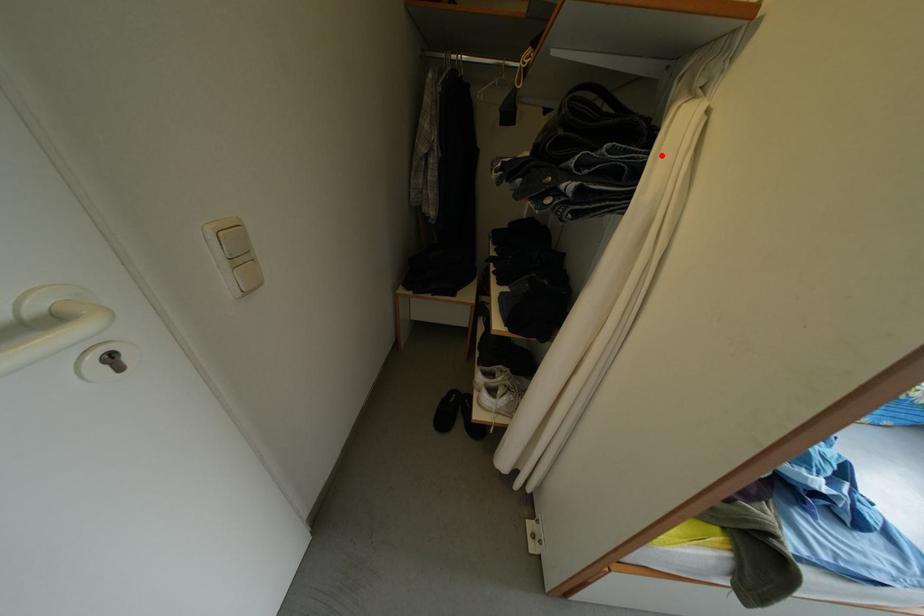
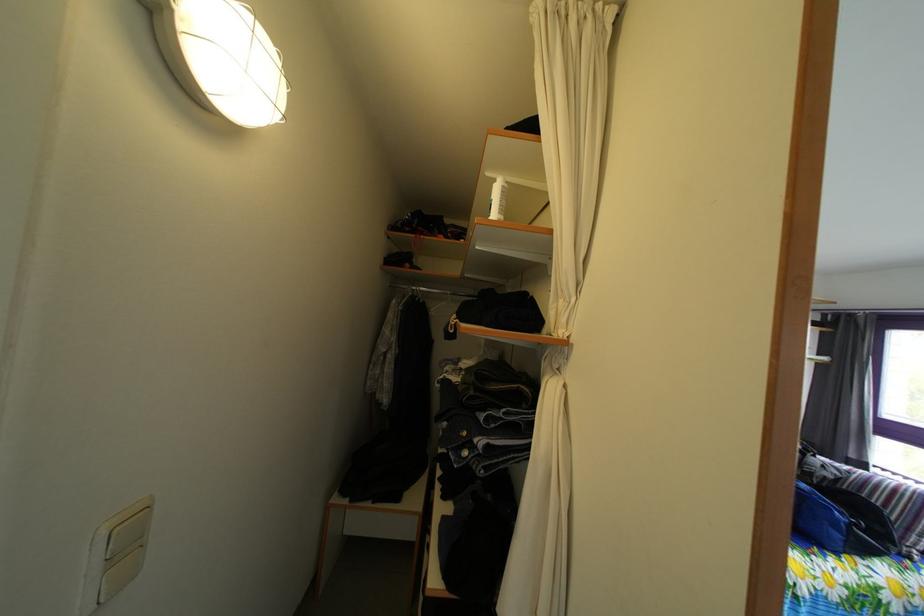
In the second image, find the point that corresponds to the highlighted location in the first image.

(545, 416)